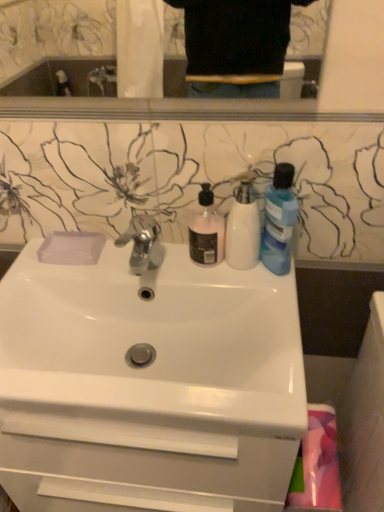
Question: Is the position of pink matte liquid soap at center, the 1th cleaning product positioned from the left, less distant than that of white matte bottle at center, marked as the 2th cleaning product in a left-to-right arrangement?

Choices:
 (A) no
 (B) yes

Answer: (A)

Question: Does pink matte liquid soap at center, the 1th cleaning product positioned from the left, have a smaller size compared to white matte bottle at center, marked as the 2th cleaning product in a left-to-right arrangement?

Choices:
 (A) yes
 (B) no

Answer: (A)

Question: Can you confirm if pink matte liquid soap at center, which is the 3th cleaning product from right to left, is wider than white matte bottle at center, marked as the 2th cleaning product in a left-to-right arrangement?

Choices:
 (A) yes
 (B) no

Answer: (B)

Question: Considering the relative positions of pink matte liquid soap at center, the 1th cleaning product positioned from the left, and white matte bottle at center, marked as the 2th cleaning product in a left-to-right arrangement, in the image provided, is pink matte liquid soap at center, the 1th cleaning product positioned from the left, to the left of white matte bottle at center, marked as the 2th cleaning product in a left-to-right arrangement, from the viewer's perspective?

Choices:
 (A) yes
 (B) no

Answer: (A)

Question: Can you confirm if pink matte liquid soap at center, which is the 3th cleaning product from right to left, is thinner than white matte bottle at center, marked as the 2th cleaning product in a left-to-right arrangement?

Choices:
 (A) no
 (B) yes

Answer: (B)

Question: Is white matte bottle at center, marked as the 2th cleaning product in a left-to-right arrangement, spatially inside polished chrome faucet at center, or outside of it?

Choices:
 (A) outside
 (B) inside

Answer: (A)

Question: Is white matte bottle at center, marked as the second cleaning product in a right-to-left arrangement, in front of or behind polished chrome faucet at center in the image?

Choices:
 (A) front
 (B) behind

Answer: (A)

Question: Is white matte bottle at center, marked as the second cleaning product in a right-to-left arrangement, wider or thinner than polished chrome faucet at center?

Choices:
 (A) thin
 (B) wide

Answer: (A)

Question: Is point (230, 252) closer or farther from the camera than point (155, 238)?

Choices:
 (A) closer
 (B) farther

Answer: (A)

Question: Looking at their shapes, would you say white glossy sink at center is wider or thinner than transparent plastic soap at upper left?

Choices:
 (A) wide
 (B) thin

Answer: (A)

Question: From the image's perspective, is white glossy sink at center positioned above or below transparent plastic soap at upper left?

Choices:
 (A) below
 (B) above

Answer: (A)

Question: Is white glossy sink at center inside the boundaries of transparent plastic soap at upper left, or outside?

Choices:
 (A) inside
 (B) outside

Answer: (B)

Question: Relative to transparent plastic soap at upper left, is white glossy sink at center in front or behind?

Choices:
 (A) behind
 (B) front

Answer: (B)

Question: From the image's perspective, is pink fabric at lower right located above or below transparent plastic soap at upper left?

Choices:
 (A) below
 (B) above

Answer: (A)

Question: From a real-world perspective, is pink fabric at lower right above or below transparent plastic soap at upper left?

Choices:
 (A) below
 (B) above

Answer: (A)